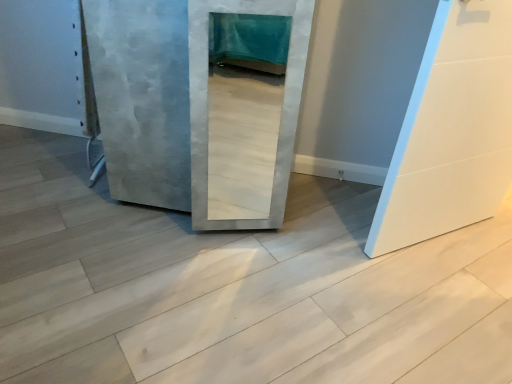
The height and width of the screenshot is (384, 512). Describe the element at coordinates (177, 100) in the screenshot. I see `concrete textured door at center, which is the 2th door in right-to-left order` at that location.

Describe the element at coordinates (234, 287) in the screenshot. The image size is (512, 384). I see `concreteroughconcrete at center` at that location.

Locate an element on the screen. This screenshot has height=384, width=512. concreteroughconcrete at center is located at coordinates (234, 287).

In order to click on white matte door at right, placed as the 1th door when sorted from right to left in this screenshot , I will do `click(452, 130)`.

Identify the location of concrete textured door at center, which is the 2th door in right-to-left order. The height and width of the screenshot is (384, 512). (177, 100).

Based on the photo, from a real-world perspective, which object stands above the other?

concrete textured door at center, which is counted as the first door, starting from the left.

Looking at this image, what's the angular difference between concreteroughconcrete at center and concrete textured door at center, which is counted as the first door, starting from the left,'s facing directions?

concreteroughconcrete at center and concrete textured door at center, which is counted as the first door, starting from the left, are facing 134 degrees away from each other.

Which point is more forward, [248,305] or [125,98]?

Point [248,305]

From the image's perspective, is concreteroughconcrete at center over concrete textured door at center, which is the 2th door in right-to-left order?

No, from the image's perspective, concreteroughconcrete at center is not on top of concrete textured door at center, which is the 2th door in right-to-left order.

Considering the relative sizes of concreteroughconcrete at center and white matte door at right, placed as the 1th door when sorted from right to left, in the image provided, is concreteroughconcrete at center taller than white matte door at right, placed as the 1th door when sorted from right to left,?

In fact, concreteroughconcrete at center may be shorter than white matte door at right, placed as the 1th door when sorted from right to left.

Choose the correct answer: Is concreteroughconcrete at center inside white matte door at right, placed as the 1th door when sorted from right to left, or outside it?

concreteroughconcrete at center cannot be found inside white matte door at right, placed as the 1th door when sorted from right to left.

Which point is more distant from viewer, (192,328) or (444,20)?

Positioned behind is point (192,328).

From the image's perspective, does concreteroughconcrete at center appear lower than white matte door at right, the second door in the left-to-right sequence?

Correct, concreteroughconcrete at center appears lower than white matte door at right, the second door in the left-to-right sequence, in the image.

How distant is white matte door at right, the second door in the left-to-right sequence, from concreteroughconcrete at center?

The distance of white matte door at right, the second door in the left-to-right sequence, from concreteroughconcrete at center is 20.68 inches.

Is white matte door at right, placed as the 1th door when sorted from right to left, facing away from concreteroughconcrete at center?

No, white matte door at right, placed as the 1th door when sorted from right to left,'s orientation is not away from concreteroughconcrete at center.

From the image's perspective, is white matte door at right, placed as the 1th door when sorted from right to left, above or below concreteroughconcrete at center?

white matte door at right, placed as the 1th door when sorted from right to left, is situated higher than concreteroughconcrete at center in the image.

Which is further, (456, 33) or (374, 262)?

The point (374, 262) is farther from the camera.

Which is in front, point (402, 224) or point (188, 176)?

The point (188, 176) is more forward.

Is white matte door at right, the second door in the left-to-right sequence, not inside concrete textured door at center, which is counted as the first door, starting from the left?

Indeed, white matte door at right, the second door in the left-to-right sequence, is completely outside concrete textured door at center, which is counted as the first door, starting from the left.

Is white matte door at right, placed as the 1th door when sorted from right to left, at the right side of concrete textured door at center, which is the 2th door in right-to-left order?

Yes.

From the picture: In the image, is white matte door at right, placed as the 1th door when sorted from right to left, positioned in front of or behind concrete textured door at center, which is counted as the first door, starting from the left?

In the image, white matte door at right, placed as the 1th door when sorted from right to left, appears in front of concrete textured door at center, which is counted as the first door, starting from the left.

Could you measure the distance between concrete textured door at center, which is the 2th door in right-to-left order, and white matte door at right, placed as the 1th door when sorted from right to left?

A distance of 26.59 inches exists between concrete textured door at center, which is the 2th door in right-to-left order, and white matte door at right, placed as the 1th door when sorted from right to left.

Considering the positions of objects concrete textured door at center, which is the 2th door in right-to-left order, and white matte door at right, placed as the 1th door when sorted from right to left, in the image provided, who is more to the left, concrete textured door at center, which is the 2th door in right-to-left order, or white matte door at right, placed as the 1th door when sorted from right to left,?

concrete textured door at center, which is the 2th door in right-to-left order, is more to the left.

Consider the image. Considering the relative sizes of concrete textured door at center, which is the 2th door in right-to-left order, and white matte door at right, the second door in the left-to-right sequence, in the image provided, is concrete textured door at center, which is the 2th door in right-to-left order, taller than white matte door at right, the second door in the left-to-right sequence,?

Incorrect, the height of concrete textured door at center, which is the 2th door in right-to-left order, is not larger of that of white matte door at right, the second door in the left-to-right sequence.

From the picture: Considering the relative sizes of concrete textured door at center, which is the 2th door in right-to-left order, and white matte door at right, the second door in the left-to-right sequence, in the image provided, is concrete textured door at center, which is the 2th door in right-to-left order, smaller than white matte door at right, the second door in the left-to-right sequence,?

Actually, concrete textured door at center, which is the 2th door in right-to-left order, might be larger than white matte door at right, the second door in the left-to-right sequence.

From a real-world perspective, is concrete textured door at center, which is the 2th door in right-to-left order, on top of concreteroughconcrete at center?

Yes.

What's the angular difference between concrete textured door at center, which is counted as the first door, starting from the left, and concreteroughconcrete at center's facing directions?

They differ by 134 degrees in their facing directions.

Consider the image. Considering the relative positions of concrete textured door at center, which is counted as the first door, starting from the left, and concreteroughconcrete at center in the image provided, is concrete textured door at center, which is counted as the first door, starting from the left, in front of concreteroughconcrete at center?

No, it is not.

Is concrete textured door at center, which is the 2th door in right-to-left order, oriented towards concreteroughconcrete at center?

No, concrete textured door at center, which is the 2th door in right-to-left order, is not oriented towards concreteroughconcrete at center.

Find the location of `door on the left of concreteroughconcrete at center`. door on the left of concreteroughconcrete at center is located at coordinates (177, 100).

Starting from the concreteroughconcrete at center, which door is the 1st one behind? Please provide its 2D coordinates.

[(452, 130)]

Looking at the image, which one is located further to concrete textured door at center, which is counted as the first door, starting from the left, concreteroughconcrete at center or white matte door at right, the second door in the left-to-right sequence?

Among the two, white matte door at right, the second door in the left-to-right sequence, is located further to concrete textured door at center, which is counted as the first door, starting from the left.

Which object lies nearer to the anchor point white matte door at right, the second door in the left-to-right sequence, concreteroughconcrete at center or concrete textured door at center, which is counted as the first door, starting from the left?

The object closer to white matte door at right, the second door in the left-to-right sequence, is concreteroughconcrete at center.

Based on their spatial positions, is white matte door at right, the second door in the left-to-right sequence, or concrete textured door at center, which is the 2th door in right-to-left order, further from concreteroughconcrete at center?

white matte door at right, the second door in the left-to-right sequence.

When comparing their distances from concreteroughconcrete at center, does concrete textured door at center, which is the 2th door in right-to-left order, or white matte door at right, placed as the 1th door when sorted from right to left, seem closer?

concrete textured door at center, which is the 2th door in right-to-left order.

From the picture: Considering their positions, is concrete textured door at center, which is counted as the first door, starting from the left, positioned further to white matte door at right, placed as the 1th door when sorted from right to left, than concreteroughconcrete at center?

Based on the image, concrete textured door at center, which is counted as the first door, starting from the left, appears to be further to white matte door at right, placed as the 1th door when sorted from right to left.

Which object lies further to the anchor point concrete textured door at center, which is the 2th door in right-to-left order, white matte door at right, the second door in the left-to-right sequence, or concreteroughconcrete at center?

white matte door at right, the second door in the left-to-right sequence.

At what (x,y) coordinates should I click in order to perform the action: click on concrete between concrete textured door at center, which is the 2th door in right-to-left order, and white matte door at right, placed as the 1th door when sorted from right to left, from left to right. Please return your answer as a coordinate pair (x, y). The width and height of the screenshot is (512, 384). Looking at the image, I should click on (234, 287).